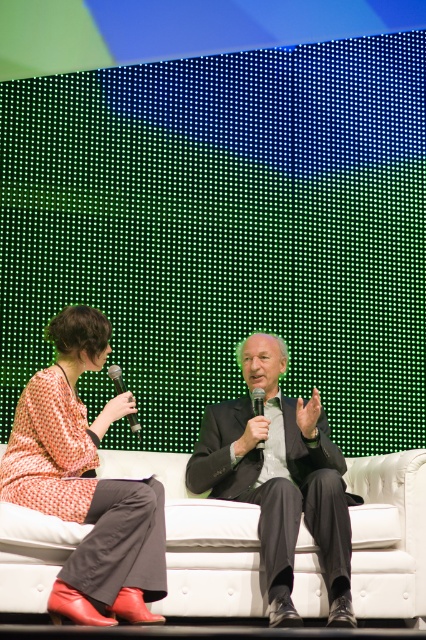
You are a photographer positioned in front of the scene. You want to capture a closeup shot of the metallic silver microphone at center without the white fabric couch at center being in focus. Is this possible given their positions?

The white fabric couch at center is closer to the viewer than the metallic silver microphone at center. To achieve a closeup of the microphone with the couch out of focus, you would need to adjust the camera focus so that the microphone is in focus while the couch is blurred. However, since the couch is closer, it might naturally be in focus unless depth of field is managed carefully with a wide aperture or longer focal length to isolate the microphone.

You are a photographer setting up for a live event. You need to place a camera on a tripod so that it can capture both the white fabric couch at center and the metallic silver microphone at center clearly. Based on their positions, which object should you position the camera closer to in order to frame both subjects properly?

The white fabric couch at center is positioned on the right side of the metallic silver microphone at center. To frame both subjects properly, the camera should be positioned closer to the metallic silver microphone at center so that both the couch and microphone are within the camera frame.

You are designing a living room layout and want to place a 12 inch wide coffee table between the white fabric couch at center and the matte black suit at center. Will the table fit between them?

The white fabric couch at center and matte black suit at center are 10.80 inches apart, so the 12 inch wide coffee table will not fit between them since it is wider than the available space.